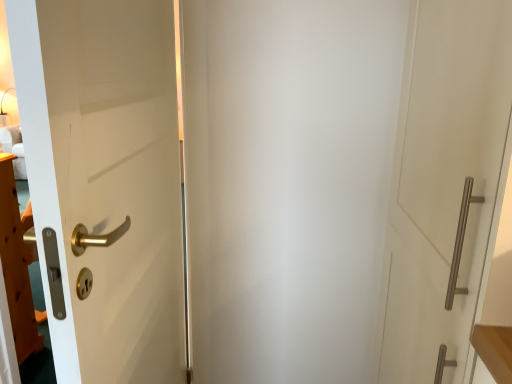
Question: Is satin nickel handle at right, which is counted as the first door, starting from the right, not inside white matte door at left, positioned as the 1th door in left-to-right order?

Choices:
 (A) no
 (B) yes

Answer: (B)

Question: Can you confirm if satin nickel handle at right, which is counted as the first door, starting from the right, is wider than white matte door at left, positioned as the 1th door in left-to-right order?

Choices:
 (A) yes
 (B) no

Answer: (A)

Question: Is satin nickel handle at right, which is counted as the first door, starting from the right, to the right of white matte door at left, positioned as the 1th door in left-to-right order, from the viewer's perspective?

Choices:
 (A) yes
 (B) no

Answer: (A)

Question: Is white matte door at left, acting as the second door starting from the right, a part of satin nickel handle at right, which is counted as the first door, starting from the right?

Choices:
 (A) yes
 (B) no

Answer: (B)

Question: Considering the relative sizes of satin nickel handle at right, which is counted as the first door, starting from the right, and white matte door at left, acting as the second door starting from the right, in the image provided, is satin nickel handle at right, which is counted as the first door, starting from the right, taller than white matte door at left, acting as the second door starting from the right,?

Choices:
 (A) no
 (B) yes

Answer: (A)

Question: From the image's perspective, does satin nickel handle at right, the 2th door in the left-to-right sequence, appear lower than white matte door at left, positioned as the 1th door in left-to-right order?

Choices:
 (A) yes
 (B) no

Answer: (B)

Question: Is white matte door at left, positioned as the 1th door in left-to-right order, placed right next to satin nickel handle at right, the 2th door in the left-to-right sequence?

Choices:
 (A) yes
 (B) no

Answer: (B)

Question: Is white matte door at left, positioned as the 1th door in left-to-right order, bigger than satin nickel handle at right, which is counted as the first door, starting from the right?

Choices:
 (A) no
 (B) yes

Answer: (A)

Question: Is white matte door at left, acting as the second door starting from the right, taller than satin nickel handle at right, the 2th door in the left-to-right sequence?

Choices:
 (A) no
 (B) yes

Answer: (B)

Question: Is white matte door at left, positioned as the 1th door in left-to-right order, not within satin nickel handle at right, the 2th door in the left-to-right sequence?

Choices:
 (A) no
 (B) yes

Answer: (B)

Question: From a real-world perspective, is white matte door at left, acting as the second door starting from the right, physically above satin nickel handle at right, the 2th door in the left-to-right sequence?

Choices:
 (A) yes
 (B) no

Answer: (B)

Question: Based on their sizes in the image, would you say white matte door at left, acting as the second door starting from the right, is bigger or smaller than satin nickel handle at right, the 2th door in the left-to-right sequence?

Choices:
 (A) small
 (B) big

Answer: (A)